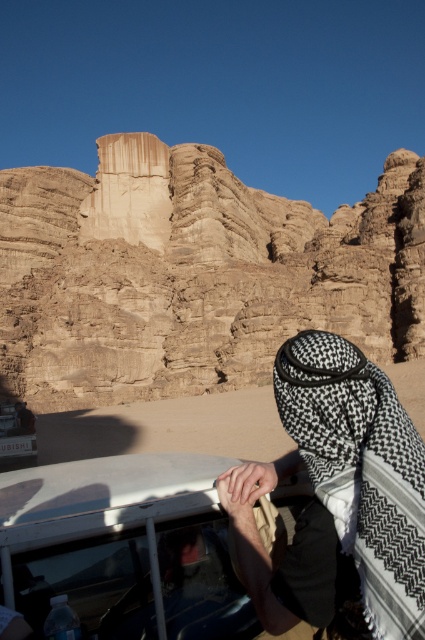
You are a photographer wanting to capture the smooth sandstone rock formation at center and the metallic silver car at lower left in a single shot. Can you see both objects clearly in your current position?

The metallic silver car at lower left is behind the smooth sandstone rock formation at center, so you cannot see both objects clearly in your current position.

You are navigating a desert jeep and want to reach the smooth sandstone rock formation at center. According to the coordinates provided, where should you aim your vehicle to reach it?

The smooth sandstone rock formation at center is located at coordinates point (x=192, y=273), so you should aim your vehicle towards that coordinate point to reach it.